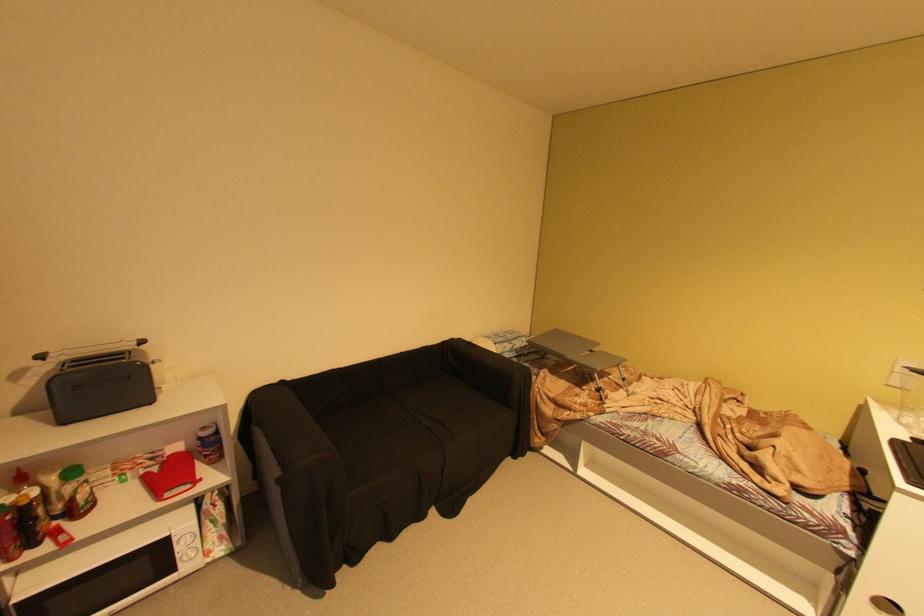
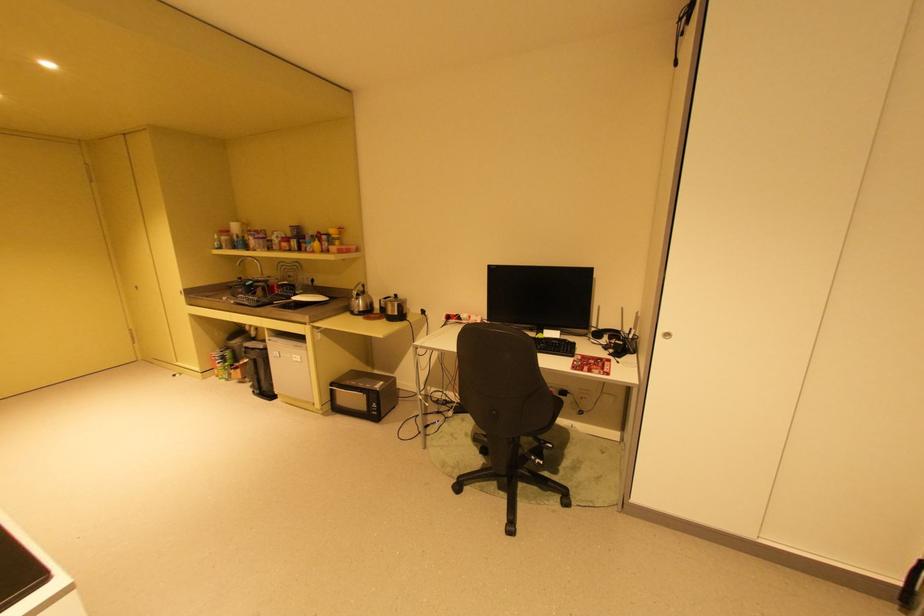
The first image is from the beginning of the video and the second image is from the end. How did the camera likely rotate when shooting the video?

The camera rotated toward right-down.